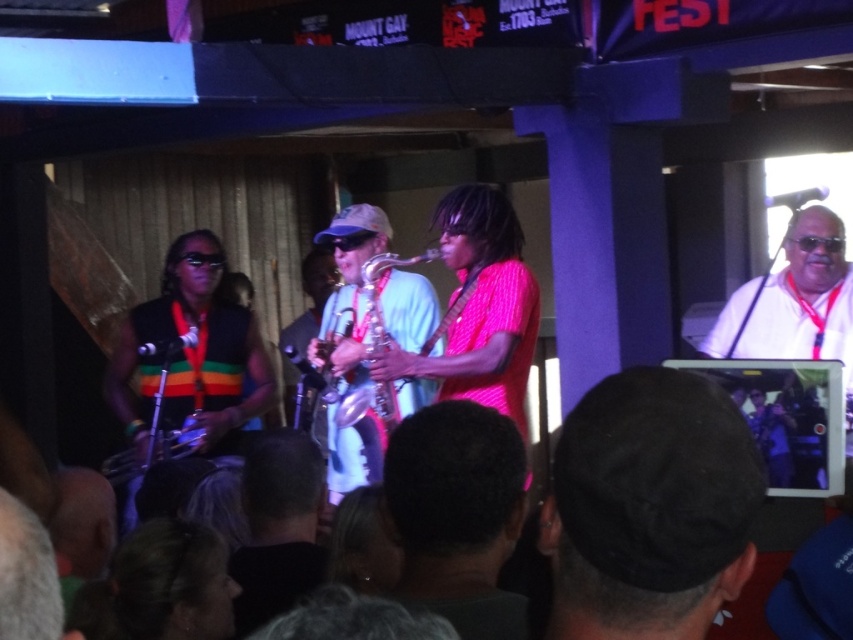
Question: Is dark brown hair at center bigger than dark brown leather jacket at center?

Choices:
 (A) yes
 (B) no

Answer: (B)

Question: Does dark brown hair at center have a greater width compared to metallic silver saxophone at center?

Choices:
 (A) yes
 (B) no

Answer: (B)

Question: Which point is closer to the camera?

Choices:
 (A) [x=401, y=260]
 (B) [x=462, y=493]
 (C) [x=753, y=339]

Answer: (B)

Question: Estimate the real-world distances between objects in this image. Which object is closer to the dark brown hair at center?

Choices:
 (A) dark brown leather jacket at center
 (B) silver metallic saxophone at center
 (C) metallic silver saxophone at center

Answer: (A)

Question: Observing the image, what is the correct spatial positioning of black leather hat at upper center in reference to dark brown leather jacket at center?

Choices:
 (A) above
 (B) below

Answer: (A)

Question: Which point is closer to the camera?

Choices:
 (A) white fabric shirt at upper right
 (B) silver metallic saxophone at center

Answer: (A)